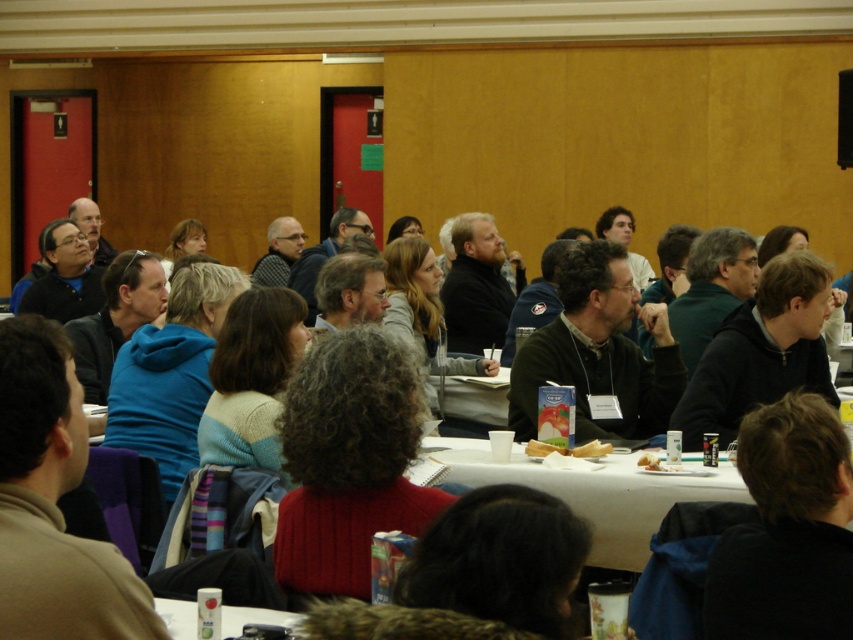
Question: Is dark brown hair at lower right to the right of white paper plate at center from the viewer's perspective?

Choices:
 (A) no
 (B) yes

Answer: (B)

Question: Among these points, which one is nearest to the camera?

Choices:
 (A) (714, 484)
 (B) (567, 452)

Answer: (A)

Question: Can you confirm if blue fleece jacket at left is positioned to the left of dark gray hoodie at center?

Choices:
 (A) yes
 (B) no

Answer: (A)

Question: Among these points, which one is farthest from the camera?

Choices:
 (A) (595, 252)
 (B) (815, 401)
 (C) (815, 269)

Answer: (A)

Question: Does dark green sweater at center appear over white paper plate at lower center?

Choices:
 (A) yes
 (B) no

Answer: (A)

Question: Which point appears farthest from the camera in this image?

Choices:
 (A) (527, 451)
 (B) (728, 470)

Answer: (A)